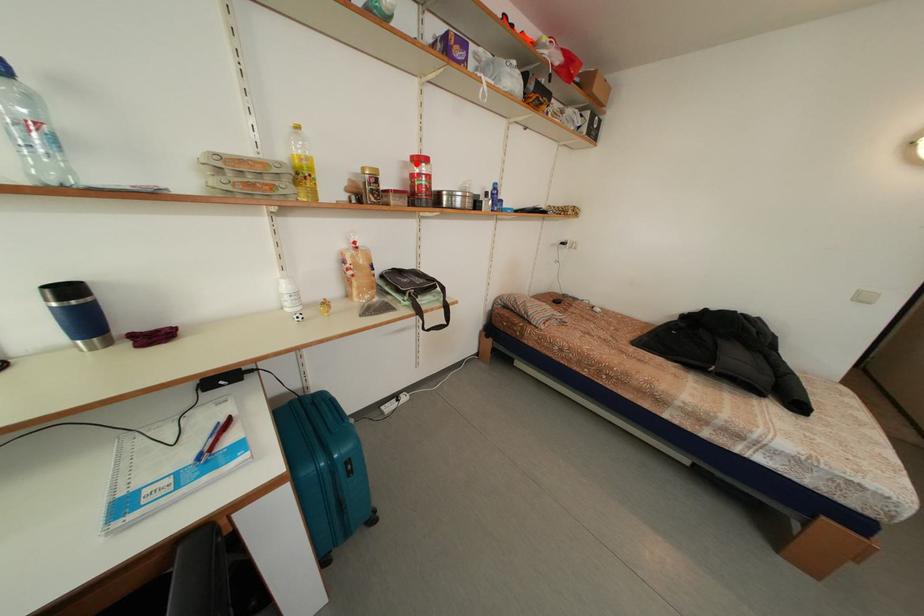
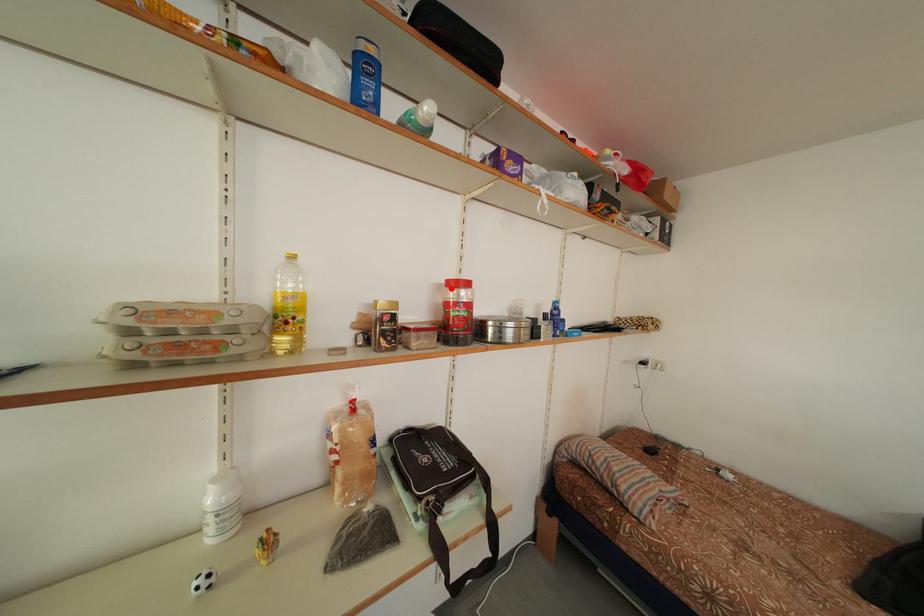
I am providing you with two images of the same scene from different viewpoints. A red point is marked on the first image and another point is marked on the second image. Is the marked point in image1 the same physical position as the marked point in image2?

Yes